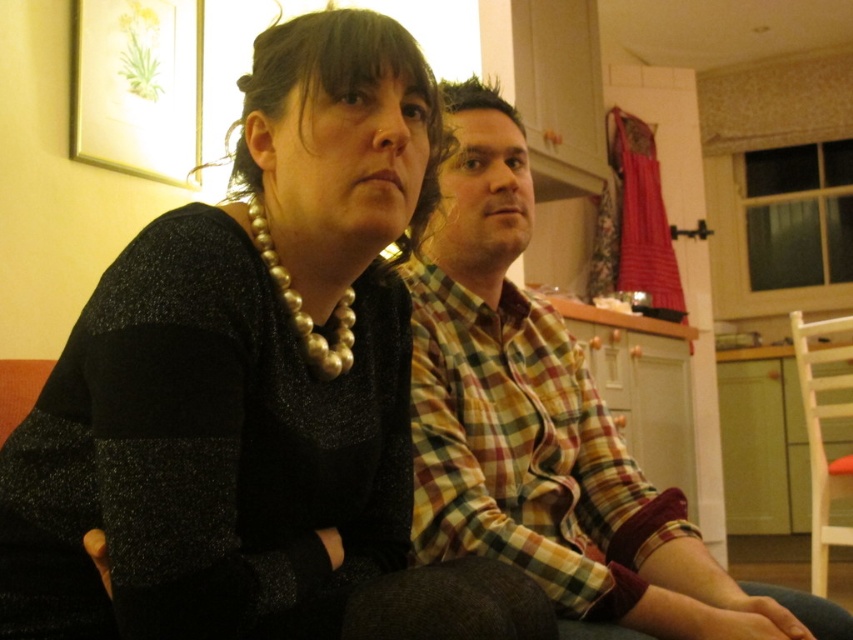
You are designing a clothing display and need to arrange the checkered fabric shirt at center and the plaid fabric shirt at center side by side on a mannequin. Based on their sizes, which shirt should be placed on the left to ensure proper alignment with the mannequin?

The checkered fabric shirt at center should be placed on the left since it is wider than the plaid fabric shirt at center, ensuring proper alignment with the mannequin.

From the picture: You are an interior designer assessing the placement of two decorative points in a living room. The points are labeled as point (590, 406) and point (630, 556). Based on their positions, which point is closer to the viewer?

Point (590, 406) is closer to the viewer than point (630, 556).